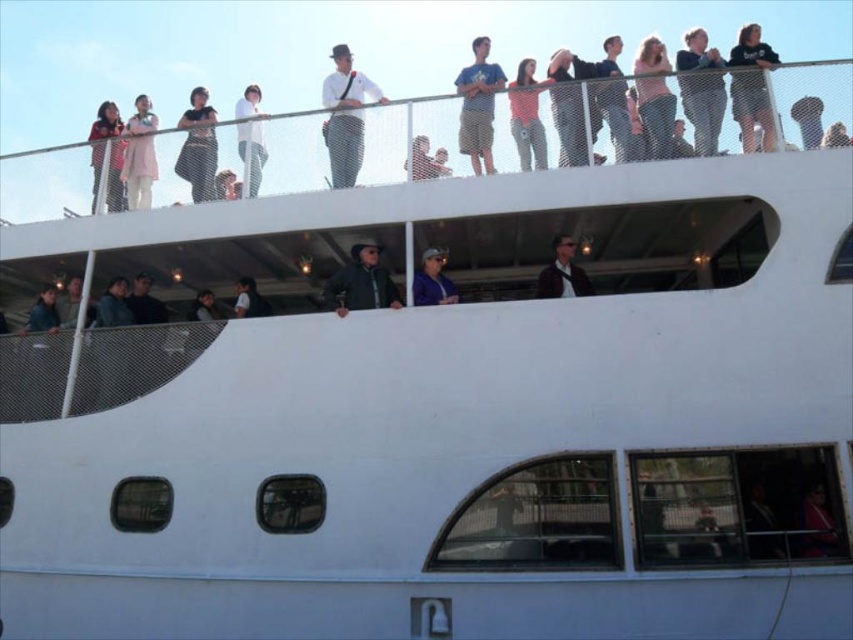
Question: Which point appears farthest from the camera in this image?

Choices:
 (A) (148, 109)
 (B) (741, 65)

Answer: (A)

Question: Does white textured pants at upper center appear on the right side of matte black jacket at upper center?

Choices:
 (A) no
 (B) yes

Answer: (A)

Question: Which is nearer to the white cotton shirt at upper center?

Choices:
 (A) matte blue shirt at upper center
 (B) matte black jacket at upper left
 (C) light blue denim shorts at upper center

Answer: (A)

Question: Which of the following is the closest to the observer?

Choices:
 (A) matte black jacket at upper left
 (B) white cotton shirt at upper center

Answer: (B)

Question: Can you confirm if white cotton shirt at upper center is positioned above matte blue shirt at upper center?

Choices:
 (A) no
 (B) yes

Answer: (B)

Question: Is dark gray jacket at center smaller than matte blue shirt at upper center?

Choices:
 (A) yes
 (B) no

Answer: (B)